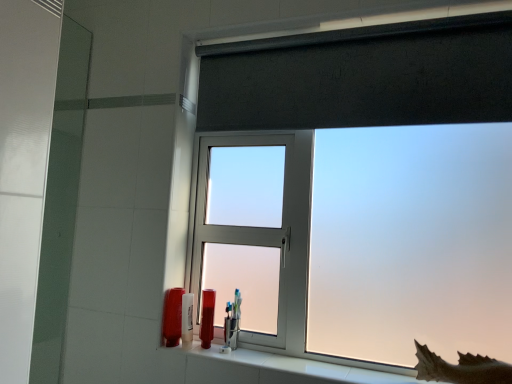
Locate an element on the screen. Image resolution: width=512 pixels, height=384 pixels. vacant region above white ceramic window sill at lower center (from a real-world perspective) is located at coordinates (294, 355).